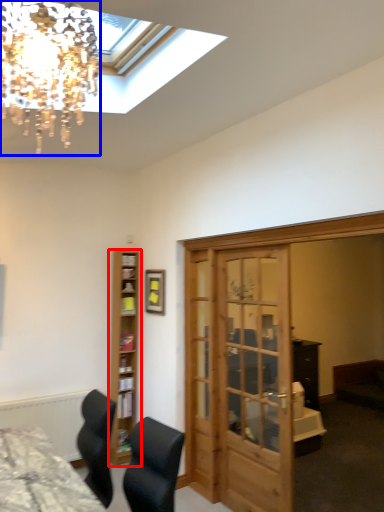
Question: Which point is closer to the camera, shelf (highlighted by a red box) or lamp (highlighted by a blue box)?

Choices:
 (A) shelf
 (B) lamp

Answer: (B)